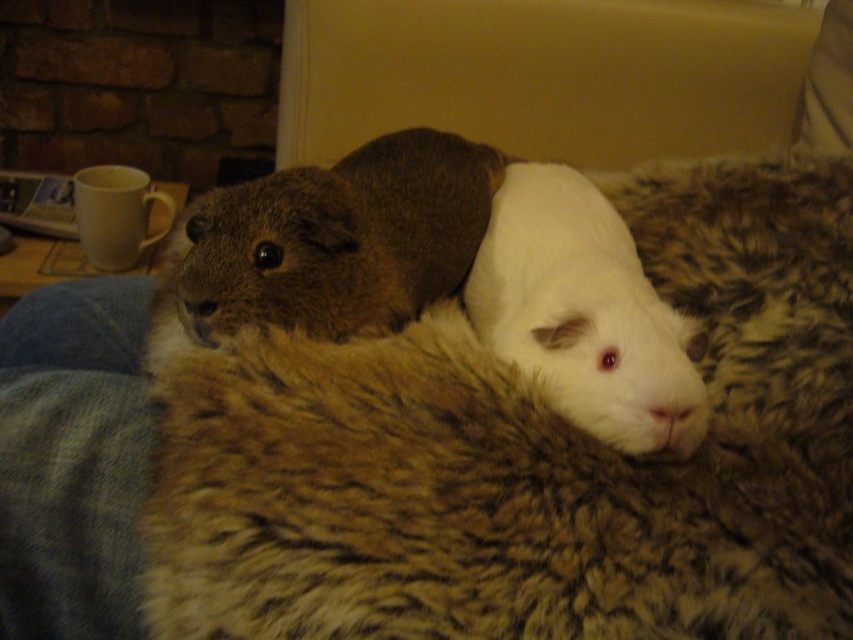
Which is behind, point (421, 170) or point (675, 404)?

Point (421, 170)

Identify the location of brown fuzzy hamster at upper center. Image resolution: width=853 pixels, height=640 pixels. (338, 237).

In order to click on brown fuzzy hamster at upper center in this screenshot , I will do 338,237.